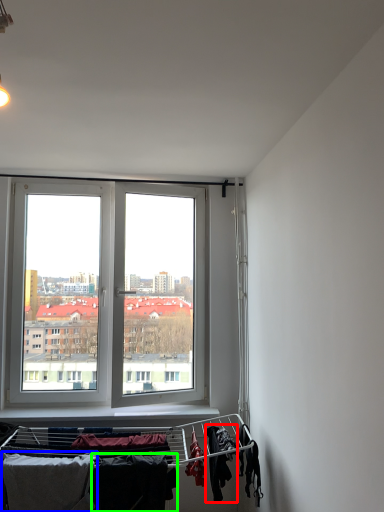
Question: Which is nearer to the clothing (highlighted by a red box)? clothing (highlighted by a blue box) or clothing (highlighted by a green box).

Choices:
 (A) clothing
 (B) clothing

Answer: (B)